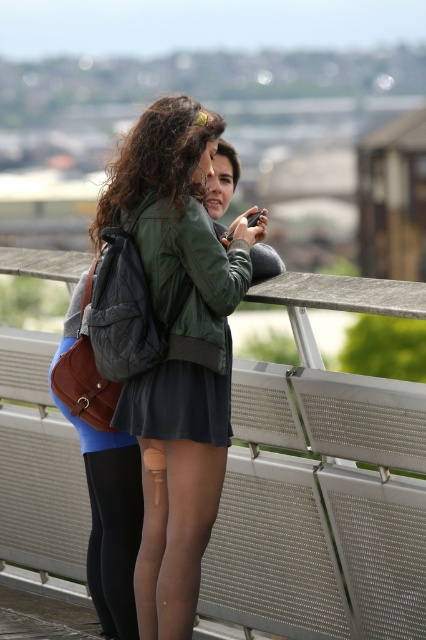
Question: Is matte green bomber jacket at center above dark gray matte dress at center?

Choices:
 (A) yes
 (B) no

Answer: (B)

Question: Among these objects, which one is nearest to the camera?

Choices:
 (A) dark gray matte dress at center
 (B) metallic gray balustrade at center

Answer: (B)

Question: Which object appears farthest from the camera in this image?

Choices:
 (A) metallic gray balustrade at center
 (B) dark gray matte dress at center
 (C) matte green bomber jacket at center

Answer: (C)

Question: Can you confirm if metallic gray balustrade at center is positioned to the left of dark gray matte dress at center?

Choices:
 (A) no
 (B) yes

Answer: (A)

Question: Among these points, which one is nearest to the camera?

Choices:
 (A) (138, 140)
 (B) (187, 358)
 (C) (399, 467)

Answer: (B)

Question: Can you confirm if matte green bomber jacket at center is positioned below dark gray matte dress at center?

Choices:
 (A) no
 (B) yes

Answer: (B)